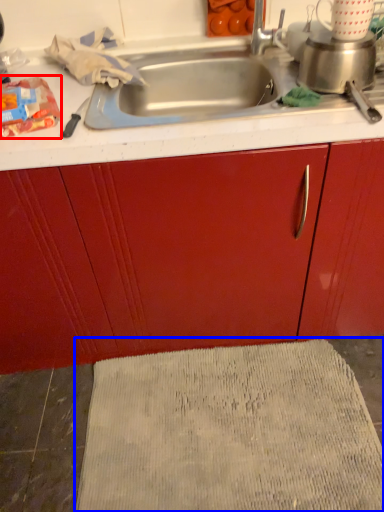
Question: Among these objects, which one is farthest to the camera, food (highlighted by a red box) or bath mat (highlighted by a blue box)?

Choices:
 (A) food
 (B) bath mat

Answer: (B)